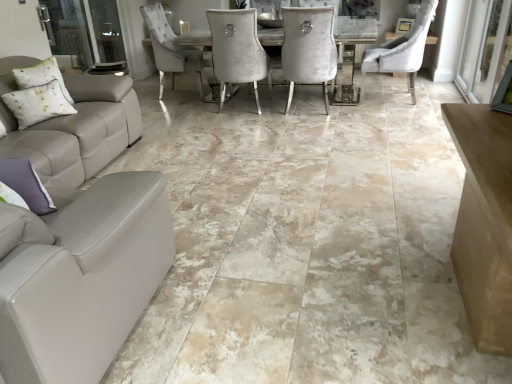
The image size is (512, 384). Find the location of `free space between velvet white chair at center, placed as the first chair when sorted from left to right, and velvet beige chair at center, the first chair when ordered from right to left`. free space between velvet white chair at center, placed as the first chair when sorted from left to right, and velvet beige chair at center, the first chair when ordered from right to left is located at coordinates pos(353,107).